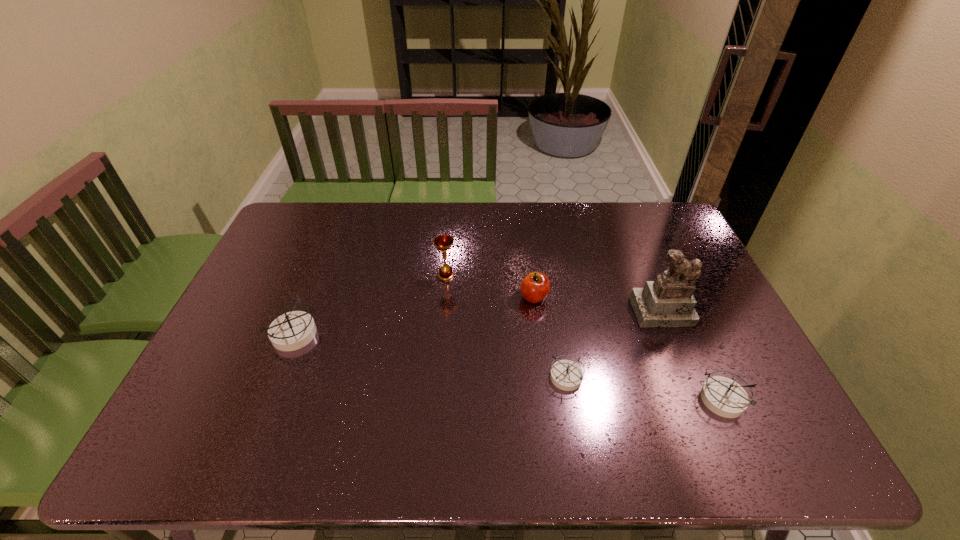
Identify the location of the leftmost compass. Image resolution: width=960 pixels, height=540 pixels. (291, 331).

I want to click on the leftmost object, so click(291, 331).

Where is `the shortest compass`? Image resolution: width=960 pixels, height=540 pixels. the shortest compass is located at coordinates (567, 375).

Find the location of `the shortest object`. the shortest object is located at coordinates (567, 375).

Find the location of a particular element. the rightmost compass is located at coordinates (723, 396).

Where is `the second shortest object`? the second shortest object is located at coordinates (723, 396).

In order to click on chalice in this screenshot , I will do `click(442, 242)`.

At what (x,y) coordinates should I click in order to perform the action: click on the fifth object from right to left. Please return your answer as a coordinate pair (x, y). Looking at the image, I should click on (442, 242).

Locate an element on the screen. figurine is located at coordinates (668, 301).

The height and width of the screenshot is (540, 960). What are the coordinates of `apple` in the screenshot? It's located at (535, 287).